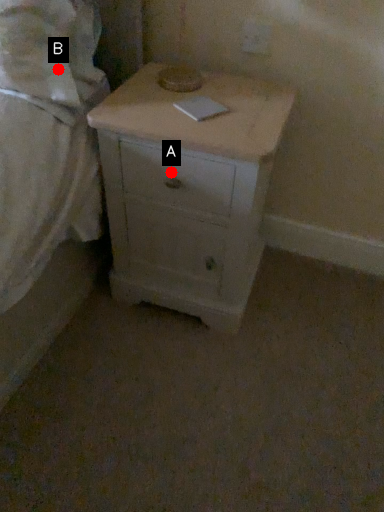
Question: Two points are circled on the image, labeled by A and B beside each circle. Which point appears farthest from the camera in this image?

Choices:
 (A) A is further
 (B) B is further

Answer: (A)